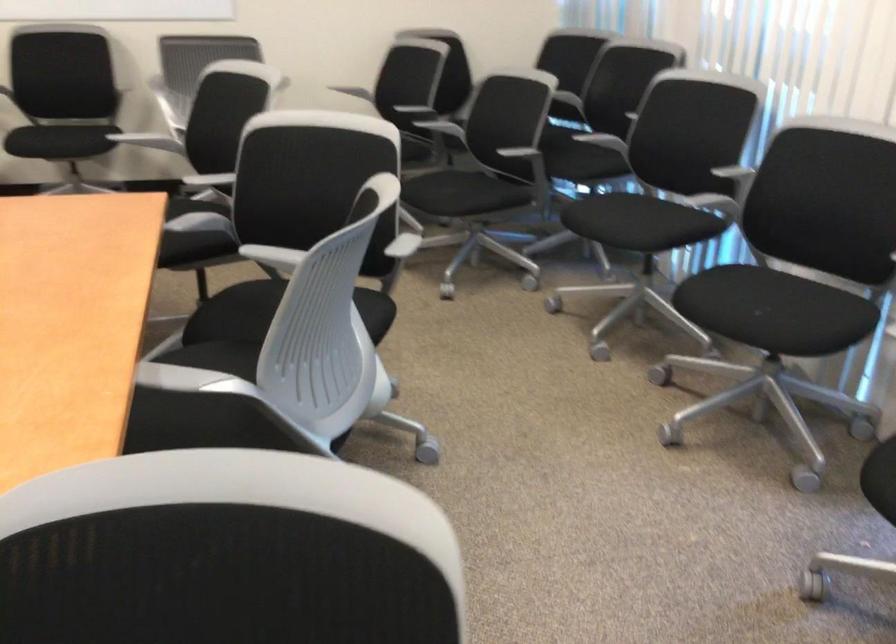
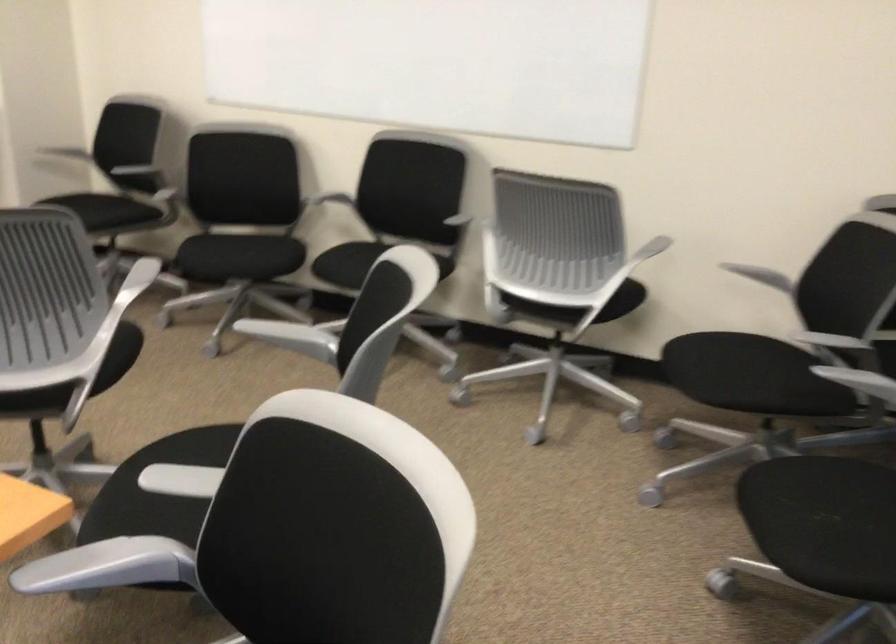
Locate, in the second image, the point that corresponds to pixel 115 82 in the first image.

(469, 207)